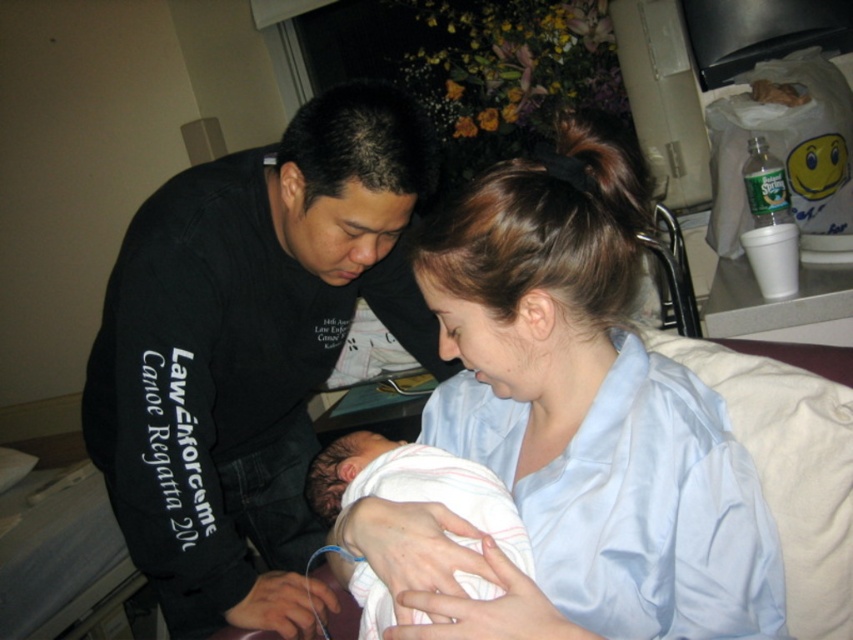
Question: Estimate the real-world distances between objects in this image. Which object is farther from the light blue satin shirt at center?

Choices:
 (A) white soft cloth at center
 (B) black matte shirt at center

Answer: (B)

Question: Is the position of light blue satin shirt at center less distant than that of white soft cloth at center?

Choices:
 (A) no
 (B) yes

Answer: (B)

Question: Is black matte shirt at center above white soft cloth at center?

Choices:
 (A) yes
 (B) no

Answer: (A)

Question: Among these points, which one is farthest from the camera?

Choices:
 (A) (363, 600)
 (B) (601, 625)
 (C) (194, 243)

Answer: (C)

Question: Which of these objects is positioned farthest from the white soft cloth at center?

Choices:
 (A) black matte shirt at center
 (B) light blue satin shirt at center

Answer: (A)

Question: Is light blue satin shirt at center further to camera compared to white soft cloth at center?

Choices:
 (A) no
 (B) yes

Answer: (A)